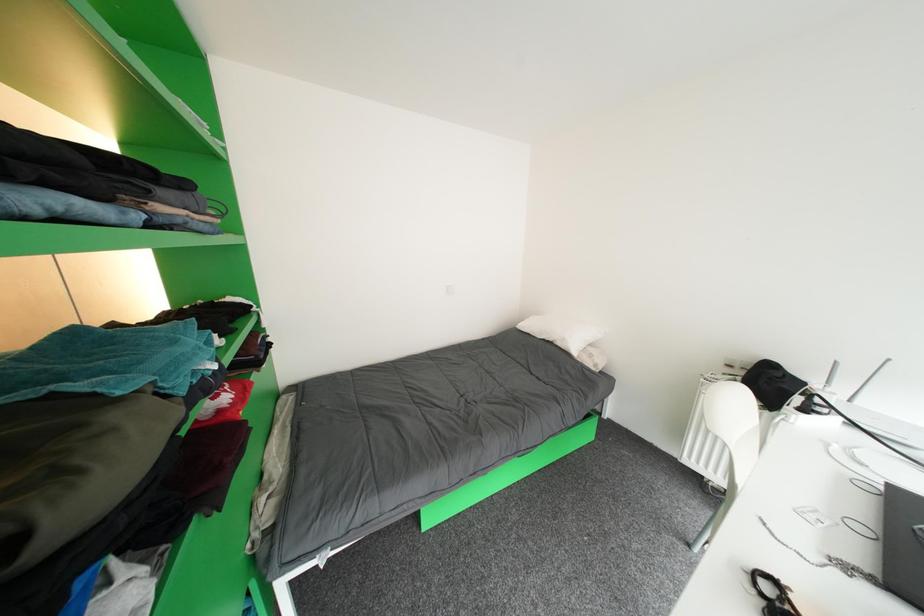
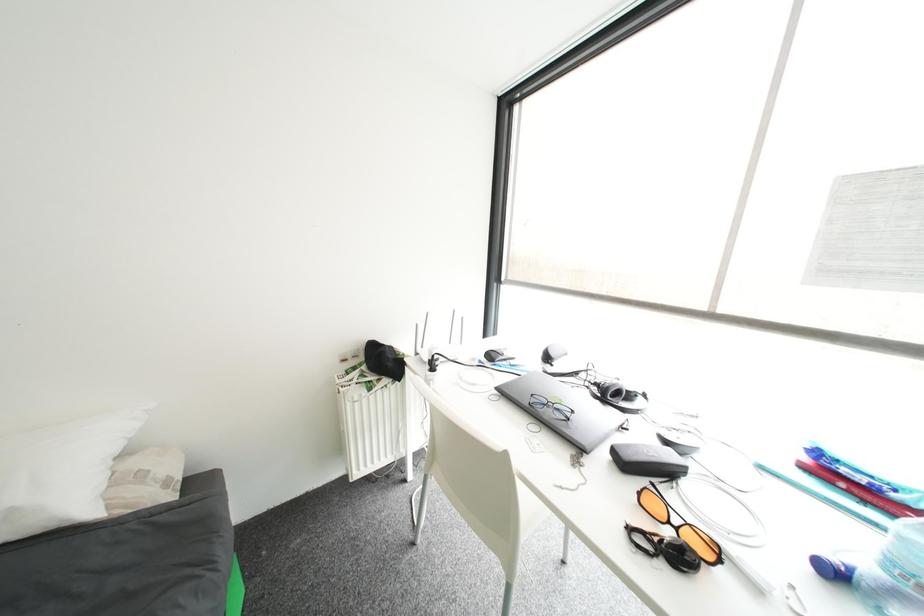
Based on the continuous images, in which direction is the camera rotating?

The camera's rotation is toward right-down.